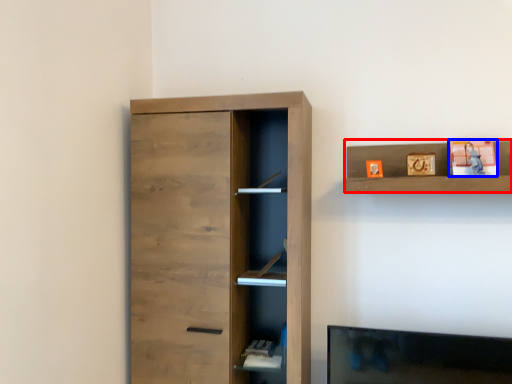
Question: Which object appears closest to the camera in this image, shelf (highlighted by a red box) or toy (highlighted by a blue box)?

Choices:
 (A) shelf
 (B) toy

Answer: (A)